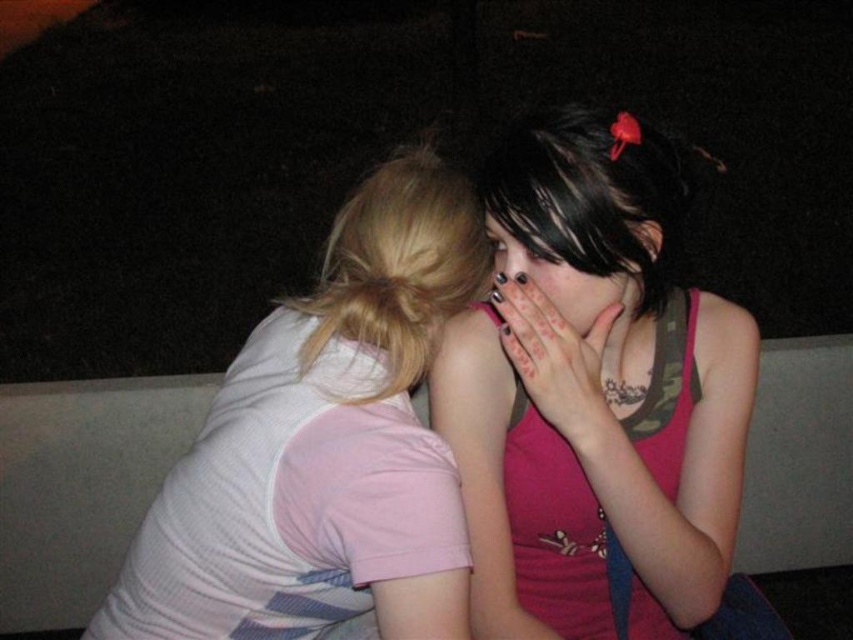
Can you confirm if white striped shirt at left is thinner than matte black hair at center?

Incorrect, white striped shirt at left's width is not less than matte black hair at center's.

Does white striped shirt at left come in front of matte black hair at center?

Yes, white striped shirt at left is in front of matte black hair at center.

Between point (339, 301) and point (489, 227), which one is positioned behind?

The point (489, 227) is behind.

Where is `white striped shirt at left`? This screenshot has width=853, height=640. white striped shirt at left is located at coordinates (323, 448).

Which is more to the right, dark matte hand at center or matte black hair at center?

matte black hair at center is more to the right.

Does dark matte hand at center have a smaller size compared to matte black hair at center?

Yes.

Who is more distant from viewer, (598,396) or (531,276)?

Point (531,276)

Locate an element on the screen. dark matte hand at center is located at coordinates pyautogui.click(x=556, y=358).

Can you confirm if pink fabric tank top at center is positioned to the left of matte black hair at center?

Incorrect, pink fabric tank top at center is not on the left side of matte black hair at center.

The image size is (853, 640). Find the location of `pink fabric tank top at center`. pink fabric tank top at center is located at coordinates (593, 394).